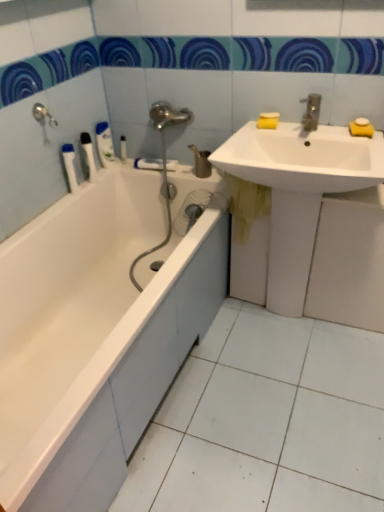
Question: Is point coord(324,189) closer or farther from the camera than point coord(87,155)?

Choices:
 (A) closer
 (B) farther

Answer: (A)

Question: Visually, is white glossy sink at upper right, positioned as the 2th sink in bottom-to-top order, positioned to the left or to the right of white plastic toothbrush at left, which is the third toiletry from right to left?

Choices:
 (A) left
 (B) right

Answer: (B)

Question: Considering the real-world distances, which object is closest to the white glossy sink at lower right, the 1th sink when ordered from bottom to top?

Choices:
 (A) white plastic toothbrush at left, which ranks as the 2th toiletry in left-to-right order
 (B) white plastic toilet brush at upper left, the second toiletry from the right
 (C) white glossy bathtub at left
 (D) metallic silver towel bar at center
 (E) yellow matte soap at upper right, the 3th soap positioned from the right

Answer: (E)

Question: Estimate the real-world distances between objects in this image. Which object is closer to the yellow matte soap at upper right, the 1th soap when ordered from left to right?

Choices:
 (A) yellow sponge at upper right, which appears as the 3th soap when viewed from the left
 (B) white glossy sink at upper right, positioned as the 2th sink in bottom-to-top order
 (C) white plastic toothbrush at left, which ranks as the 2th toiletry in left-to-right order
 (D) white plastic bottle at left, positioned as the 1th toiletry in left-to-right order
 (E) metallic faucet at upper right

Answer: (E)